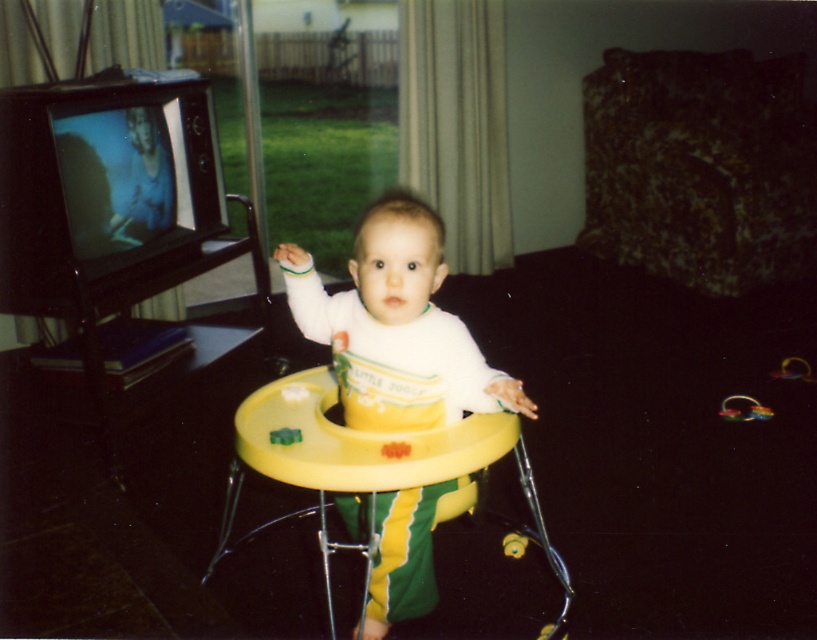
Who is higher up, rubberized plastic toy at center or green plastic walker at center?

Positioned higher is green plastic walker at center.

Is point (731, 404) positioned before point (293, 432)?

No, it is behind (293, 432).

The width and height of the screenshot is (817, 640). What are the coordinates of `rubberized plastic toy at center` in the screenshot? It's located at (743, 408).

Is point (485, 381) closer to viewer compared to point (739, 406)?

Yes, point (485, 381) is closer to viewer.

Between white matte walker at center and rubberized plastic toy at center, which one is positioned lower?

rubberized plastic toy at center is below.

Is point (521, 408) positioned behind point (751, 403)?

No, (521, 408) is in front of (751, 403).

Locate an element on the screen. Image resolution: width=817 pixels, height=640 pixels. white matte walker at center is located at coordinates (396, 326).

Is the position of white matte walker at center more distant than that of green plastic walker at center?

No, white matte walker at center is closer to the viewer.

Is white matte walker at center shorter than green plastic walker at center?

Incorrect, white matte walker at center's height does not fall short of green plastic walker at center's.

Is point (389, 371) positioned in front of point (286, 435)?

No.

Find the location of `white matte walker at center`. white matte walker at center is located at coordinates (396, 326).